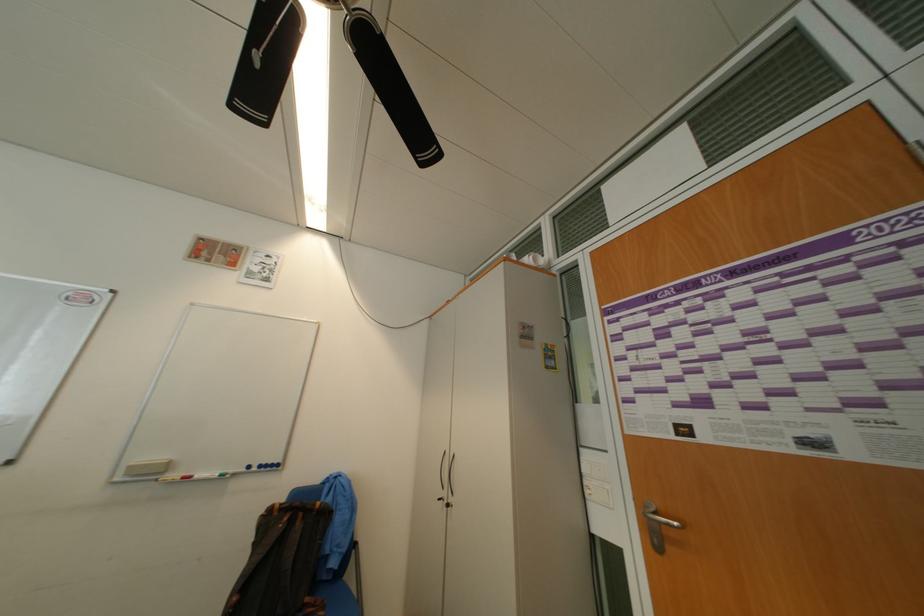
Identify the location of white light switch. [x=144, y=471].